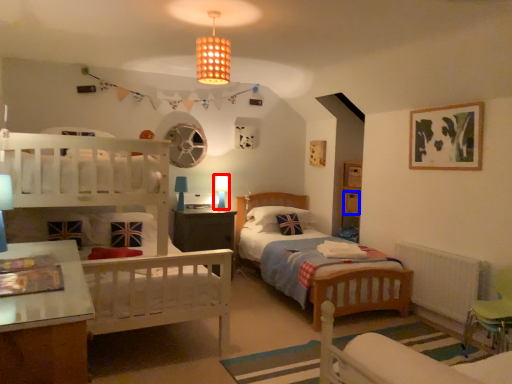
Question: Which object is closer to the camera taking this photo, table lamp (highlighted by a red box) or drawer (highlighted by a blue box)?

Choices:
 (A) table lamp
 (B) drawer

Answer: (B)